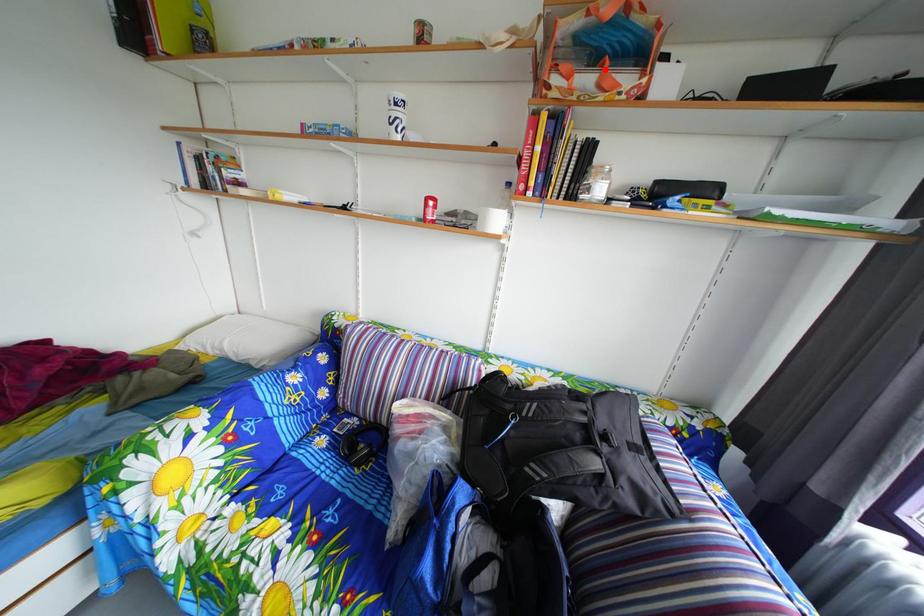
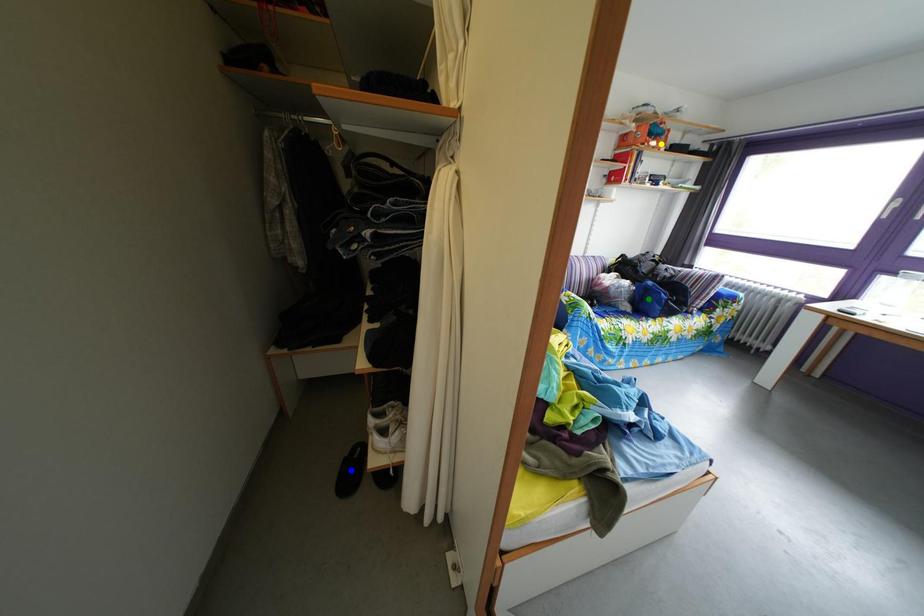
Question: I am providing you with two images of the same scene from different viewpoints. A red point is marked on the first image. You are given multiple points on the second image. Can you choose the point in image 2 that corresponds to the point in image 1?

Choices:
 (A) blue point
 (B) green point
 (C) yellow point

Answer: (C)